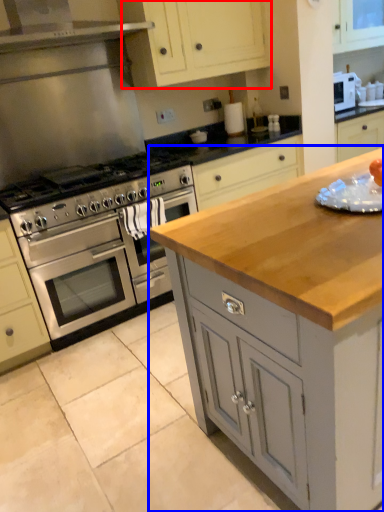
Question: Which object is closer to the camera taking this photo, cabinetry (highlighted by a red box) or cabinetry (highlighted by a blue box)?

Choices:
 (A) cabinetry
 (B) cabinetry

Answer: (B)